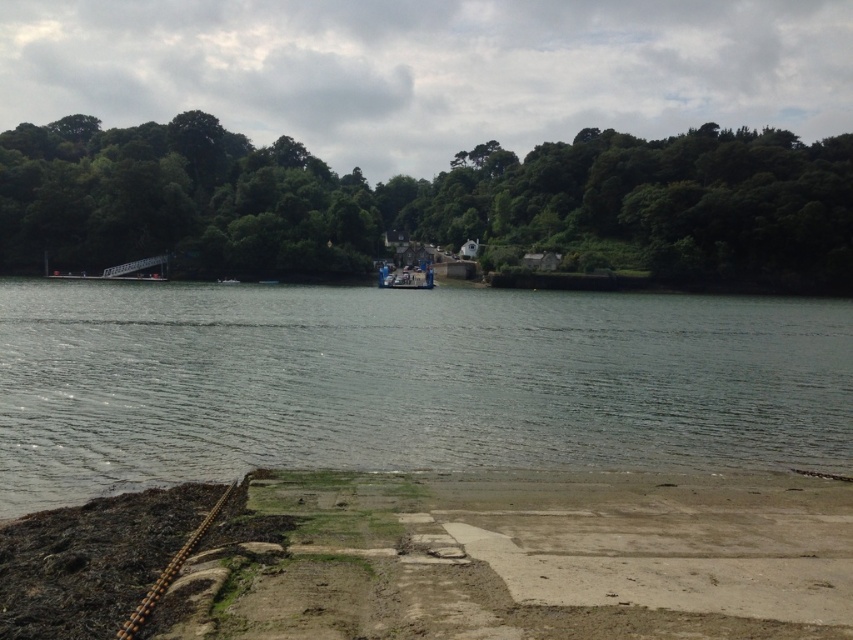
Question: Which object is closer to the camera taking this photo?

Choices:
 (A) dull concrete pier at lower center
 (B) green leafy trees at center
 (C) greenish-gray water at center
 (D) metallic blue boat at center

Answer: (A)

Question: From the image, what is the correct spatial relationship of greenish-gray water at center in relation to dull concrete pier at lower center?

Choices:
 (A) left
 (B) right

Answer: (B)

Question: Which of these objects is positioned farthest from the green leafy trees at center?

Choices:
 (A) metallic blue boat at center
 (B) greenish-gray water at center

Answer: (B)

Question: Considering the real-world distances, which object is farthest from the green leafy trees at center?

Choices:
 (A) greenish-gray water at center
 (B) metallic blue boat at center
 (C) dull concrete pier at lower center

Answer: (C)

Question: Does greenish-gray water at center come behind metallic blue boat at center?

Choices:
 (A) yes
 (B) no

Answer: (B)

Question: Can you confirm if greenish-gray water at center is positioned to the right of dull concrete pier at lower center?

Choices:
 (A) no
 (B) yes

Answer: (B)